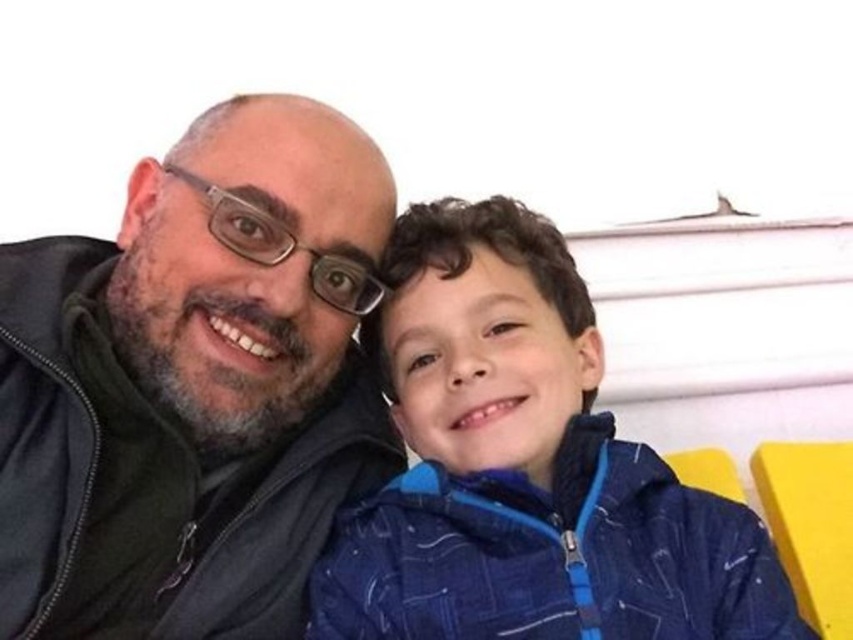
You are a photographer trying to capture a candid shot of the two people in the scene. You want to ensure both the matte black jacket at left and the blue textured jacket at center are visible in the frame. Based on their positions, which jacket should you focus on first to ensure both are in the shot?

Since the matte black jacket at left is to the left of the blue textured jacket at center, you should focus on the blue textured jacket at center first as it is closer to the center of the frame, ensuring both jackets remain in the shot.

You are a photographer trying to capture a clear shot of both the matte black jacket at left and the blue textured jacket at center. Since you can only focus on one object at a time, which jacket should you focus on to ensure the other remains in the background?

You should focus on the matte black jacket at left because it is closer to the viewer than the blue textured jacket at center, so focusing on it will keep the blue textured jacket at center in the background.

You are a photographer adjusting the lighting for a portrait. You notice the matte black jacket at left and the blue textured jacket at center in the frame. Which jacket should you focus on to ensure proper exposure, considering the positioning of the jackets?

The matte black jacket at left is positioned over the blue textured jacket at center, so focusing on the matte black jacket at left would ensure proper exposure as it is in front and likely receiving more direct light.